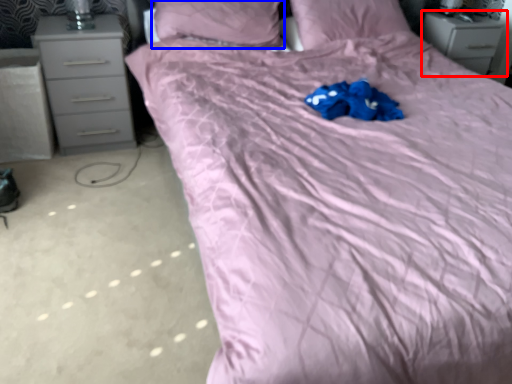
Question: Which point is closer to the camera, chest of drawers (highlighted by a red box) or pillow (highlighted by a blue box)?

Choices:
 (A) chest of drawers
 (B) pillow

Answer: (B)